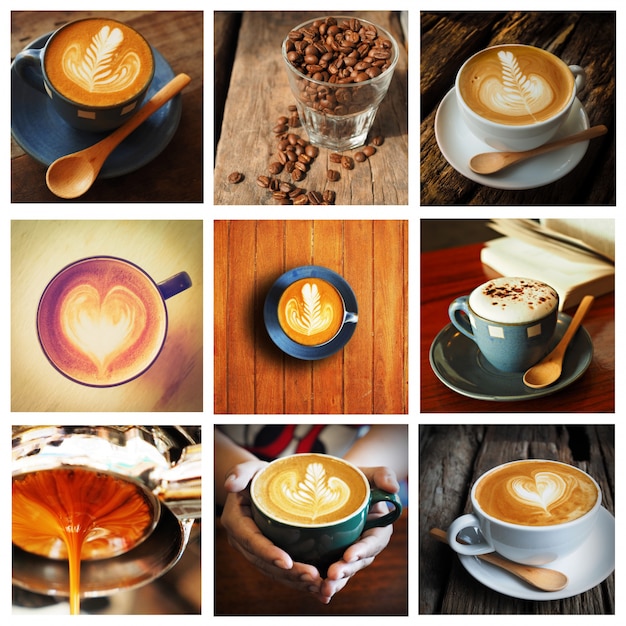
Locate an element on the screen. Image resolution: width=626 pixels, height=626 pixels. wooden table is located at coordinates (362, 379), (381, 183), (168, 48), (536, 27), (441, 300), (456, 468).